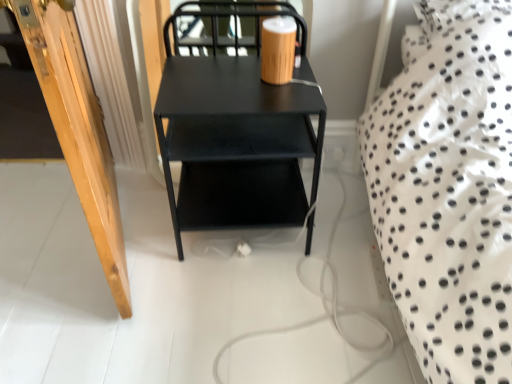
I want to click on free space on the front side of wooden door at left, so click(x=100, y=312).